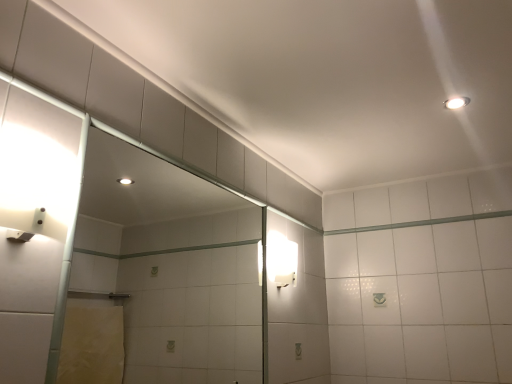
Locate an element on the screen. clear glass door at left is located at coordinates (170, 265).

The image size is (512, 384). I want to click on clear glass door at left, so click(170, 265).

From the image's perspective, is white frosted glass sconce at right, the 1th light fixture when ordered from left to right, located beneath white glossy light fixture at upper right, which appears as the second light fixture when viewed from the left?

Indeed, from the image's perspective, white frosted glass sconce at right, the 1th light fixture when ordered from left to right, is shown beneath white glossy light fixture at upper right, which appears as the second light fixture when viewed from the left.

Considering the positions of points (285, 254) and (454, 103), is point (285, 254) closer to camera compared to point (454, 103)?

No, it is behind (454, 103).

Is white frosted glass sconce at right, the 2th light fixture positioned from the right, in contact with white glossy light fixture at upper right, which appears as the second light fixture when viewed from the left?

white frosted glass sconce at right, the 2th light fixture positioned from the right, and white glossy light fixture at upper right, which appears as the second light fixture when viewed from the left, are clearly separated.

Is white frosted glass sconce at right, which is the second light fixture from front to back, smaller than white glossy light fixture at upper right, which appears as the second light fixture when viewed from the back?

No, white frosted glass sconce at right, which is the second light fixture from front to back, is not smaller than white glossy light fixture at upper right, which appears as the second light fixture when viewed from the back.

Between white glossy light fixture at upper right, placed as the first light fixture when sorted from right to left, and clear glass door at left, which one has larger size?

clear glass door at left.

Visually, is white glossy light fixture at upper right, the first light fixture from the top, positioned to the left or to the right of clear glass door at left?

In the image, white glossy light fixture at upper right, the first light fixture from the top, appears on the right side of clear glass door at left.

From a real-world perspective, is white glossy light fixture at upper right, placed as the first light fixture when sorted from right to left, located higher than clear glass door at left?

Yes, from a real-world perspective, white glossy light fixture at upper right, placed as the first light fixture when sorted from right to left, is on top of clear glass door at left.

Measure the distance from white glossy light fixture at upper right, which appears as the second light fixture when viewed from the back, to clear glass door at left.

6.65 feet.

Is the surface of white frosted glass sconce at right, arranged as the 1th light fixture when viewed from the back, in direct contact with clear glass door at left?

No, white frosted glass sconce at right, arranged as the 1th light fixture when viewed from the back, is not in contact with clear glass door at left.

How different are the orientations of white frosted glass sconce at right, the 2th light fixture positioned from the top, and clear glass door at left in degrees?

0.000454 degrees.

Is white frosted glass sconce at right, arranged as the 1th light fixture when viewed from the back, further to camera compared to clear glass door at left?

Yes, it is behind clear glass door at left.

Considering the positions of point (272, 263) and point (151, 316), is point (272, 263) closer or farther from the camera than point (151, 316)?

Point (272, 263) is positioned closer to the camera compared to point (151, 316).

The height and width of the screenshot is (384, 512). I want to click on glass door on the left of white glossy light fixture at upper right, the 2th light fixture positioned from the bottom, so click(x=170, y=265).

Considering the sizes of clear glass door at left and white glossy light fixture at upper right, placed as the first light fixture when sorted from right to left, in the image, is clear glass door at left taller or shorter than white glossy light fixture at upper right, placed as the first light fixture when sorted from right to left,?

In the image, clear glass door at left appears to be taller than white glossy light fixture at upper right, placed as the first light fixture when sorted from right to left.

Does point (179, 199) come in front of point (464, 98)?

No.

From their relative heights in the image, would you say clear glass door at left is taller or shorter than white frosted glass sconce at right, the 2th light fixture positioned from the right?

Clearly, clear glass door at left is taller compared to white frosted glass sconce at right, the 2th light fixture positioned from the right.

From a real-world perspective, which object rests below the other?

In real-world perspective, clear glass door at left is lower.

Is clear glass door at left positioned in front of white frosted glass sconce at right, the 2th light fixture positioned from the right?

Yes, it is.

Which of these two, clear glass door at left or white frosted glass sconce at right, which is the second light fixture from front to back, is wider?

Wider between the two is white frosted glass sconce at right, which is the second light fixture from front to back.

Does white glossy light fixture at upper right, the 2th light fixture positioned from the bottom, come behind white frosted glass sconce at right, the 2th light fixture positioned from the top?

No, white glossy light fixture at upper right, the 2th light fixture positioned from the bottom, is closer to the camera.

Is white frosted glass sconce at right, which is the second light fixture from front to back, completely or partially inside white glossy light fixture at upper right, placed as the first light fixture when sorted from right to left?

No, white frosted glass sconce at right, which is the second light fixture from front to back, is located outside of white glossy light fixture at upper right, placed as the first light fixture when sorted from right to left.

Is there a large distance between white glossy light fixture at upper right, which appears as the second light fixture when viewed from the left, and white frosted glass sconce at right, the 2th light fixture positioned from the right?

Actually, white glossy light fixture at upper right, which appears as the second light fixture when viewed from the left, and white frosted glass sconce at right, the 2th light fixture positioned from the right, are a little close together.

Considering the relative sizes of white glossy light fixture at upper right, which is the first light fixture from front to back, and white frosted glass sconce at right, which is the first light fixture in bottom-to-top order, in the image provided, is white glossy light fixture at upper right, which is the first light fixture from front to back, thinner than white frosted glass sconce at right, which is the first light fixture in bottom-to-top order,?

No.

The height and width of the screenshot is (384, 512). What are the coordinates of `light fixture that appears on the right of white frosted glass sconce at right, which is the first light fixture in bottom-to-top order` in the screenshot? It's located at (456, 102).

Identify the location of glass door on the left of the white glossy light fixture at upper right, the 2th light fixture positioned from the bottom. This screenshot has width=512, height=384. (170, 265).

Estimate the real-world distances between objects in this image. Which object is closer to clear glass door at left, white glossy light fixture at upper right, which is the first light fixture from front to back, or white frosted glass sconce at right, the 1th light fixture when ordered from left to right?

white frosted glass sconce at right, the 1th light fixture when ordered from left to right.

Based on their spatial positions, is clear glass door at left or white frosted glass sconce at right, the 2th light fixture positioned from the top, further from white glossy light fixture at upper right, the 2th light fixture positioned from the bottom?

clear glass door at left.

From the picture: Considering their positions, is white frosted glass sconce at right, the 2th light fixture positioned from the right, positioned closer to clear glass door at left than white glossy light fixture at upper right, which is the first light fixture from front to back?

white frosted glass sconce at right, the 2th light fixture positioned from the right, is positioned closer to the anchor clear glass door at left.

When comparing their distances from white frosted glass sconce at right, the 1th light fixture when ordered from left to right, does clear glass door at left or white glossy light fixture at upper right, the 2th light fixture positioned from the bottom, seem further?

clear glass door at left is further to white frosted glass sconce at right, the 1th light fixture when ordered from left to right.

Looking at the image, which one is located further to white frosted glass sconce at right, which is the second light fixture from front to back, white glossy light fixture at upper right, which appears as the second light fixture when viewed from the back, or clear glass door at left?

clear glass door at left is positioned further to the anchor white frosted glass sconce at right, which is the second light fixture from front to back.

From the image, which object appears to be farther from white glossy light fixture at upper right, placed as the first light fixture when sorted from right to left, white frosted glass sconce at right, the 2th light fixture positioned from the top, or clear glass door at left?

clear glass door at left lies further to white glossy light fixture at upper right, placed as the first light fixture when sorted from right to left, than the other object.

You are a GUI agent. You are given a task and a screenshot of the screen. Output one action in this format:
    pyautogui.click(x=<x>, y=<y>)
    Task: Click on the light fixture located between clear glass door at left and white glossy light fixture at upper right, which appears as the second light fixture when viewed from the back, in the left-right direction
    
    Given the screenshot: What is the action you would take?
    (x=281, y=260)